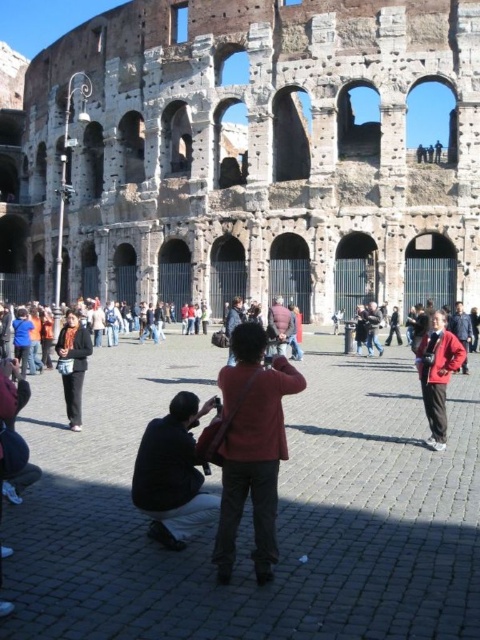
Does red fabric jacket at center have a greater height compared to dark brown leather jacket at lower center?

Indeed, red fabric jacket at center has a greater height compared to dark brown leather jacket at lower center.

Is red fabric jacket at center to the left of dark brown leather jacket at lower center from the viewer's perspective?

No, red fabric jacket at center is not to the left of dark brown leather jacket at lower center.

What do you see at coordinates (252, 448) in the screenshot?
I see `red fabric jacket at center` at bounding box center [252, 448].

What are the coordinates of `red fabric jacket at center` in the screenshot? It's located at (252, 448).

Does point (143, 500) lie behind point (429, 378)?

That is False.

Is dark brown leather jacket at lower center taller than red matte jacket at center?

In fact, dark brown leather jacket at lower center may be shorter than red matte jacket at center.

Is point (132, 484) more distant than point (420, 358)?

No, (132, 484) is closer to viewer.

You are a GUI agent. You are given a task and a screenshot of the screen. Output one action in this format:
    pyautogui.click(x=<x>, y=<y>)
    Task: Click on the dark brown leather jacket at lower center
    This screenshot has width=480, height=640.
    Given the screenshot: What is the action you would take?
    pyautogui.click(x=172, y=474)

Between dark gray fabric jacket at lower left and red jacket at center, which one has more height?

Standing taller between the two is dark gray fabric jacket at lower left.

This screenshot has height=640, width=480. What do you see at coordinates (72, 365) in the screenshot?
I see `dark gray fabric jacket at lower left` at bounding box center [72, 365].

Is point (60, 358) behind point (467, 369)?

No, (60, 358) is in front of (467, 369).

Locate an element on the screen. dark gray fabric jacket at lower left is located at coordinates (72, 365).